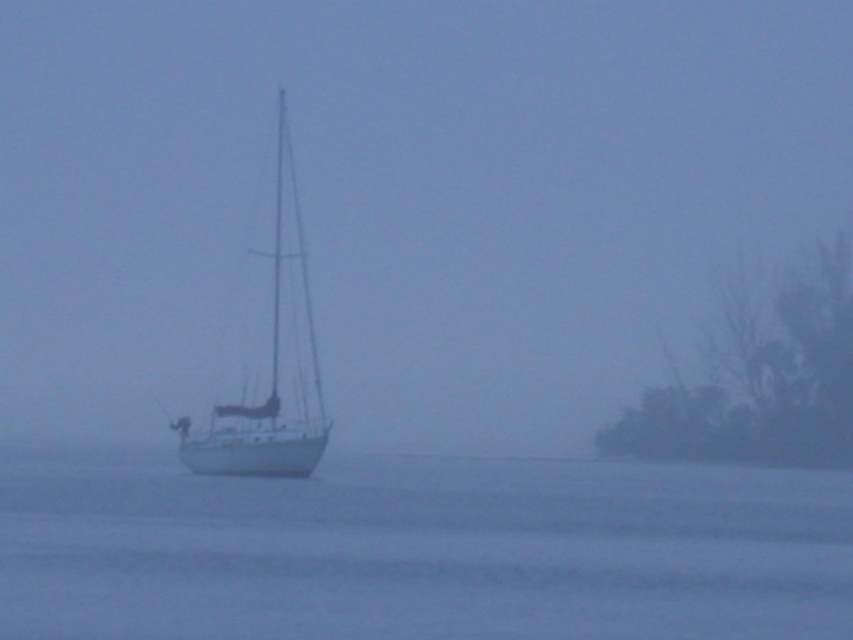
Describe the element at coordinates (422, 552) in the screenshot. I see `white water at center` at that location.

Is point (544, 627) positioned after point (279, 454)?

No, (544, 627) is closer to viewer.

Between point (103, 513) and point (274, 321), which one is positioned behind?

The point (274, 321) is behind.

At what (x,y) coordinates should I click in order to perform the action: click on white water at center. Please return your answer as a coordinate pair (x, y). This screenshot has height=640, width=853. Looking at the image, I should click on (422, 552).

Who is higher up, foggy white sailboat at center or white matte sailboat at center?

Positioned higher is white matte sailboat at center.

Is foggy white sailboat at center behind white matte sailboat at center?

Yes, it is.

Which is behind, point (692, 163) or point (236, 449)?

The point (692, 163) is behind.

This screenshot has height=640, width=853. Find the location of `foggy white sailboat at center`. foggy white sailboat at center is located at coordinates [x=398, y=200].

Who is shorter, foggy white sailboat at center or white water at center?

white water at center

Is foggy white sailboat at center shorter than white water at center?

Incorrect, foggy white sailboat at center's height does not fall short of white water at center's.

Image resolution: width=853 pixels, height=640 pixels. Describe the element at coordinates (398, 200) in the screenshot. I see `foggy white sailboat at center` at that location.

Locate an element on the screen. The height and width of the screenshot is (640, 853). foggy white sailboat at center is located at coordinates [398, 200].